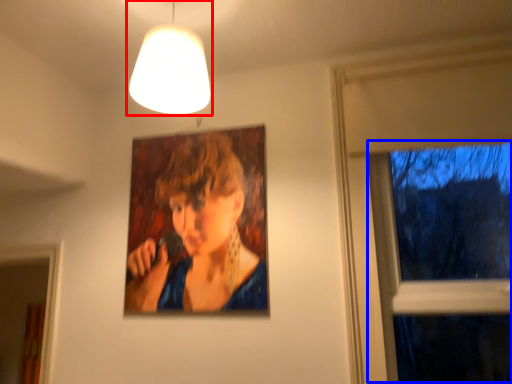
Question: Among these objects, which one is nearest to the camera, lamp (highlighted by a red box) or window (highlighted by a blue box)?

Choices:
 (A) lamp
 (B) window

Answer: (A)